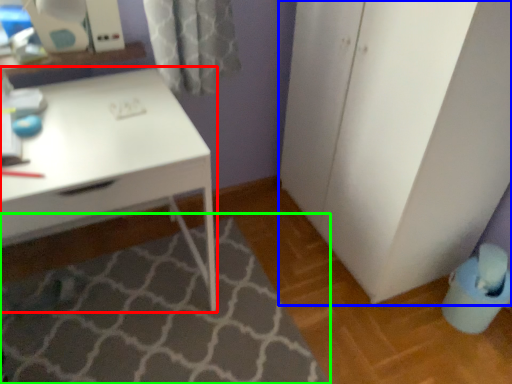
Question: Estimate the real-world distances between objects in this image. Which object is farther from desk (highlighted by a red box), file cabinet (highlighted by a blue box) or bath mat (highlighted by a green box)?

Choices:
 (A) file cabinet
 (B) bath mat

Answer: (A)